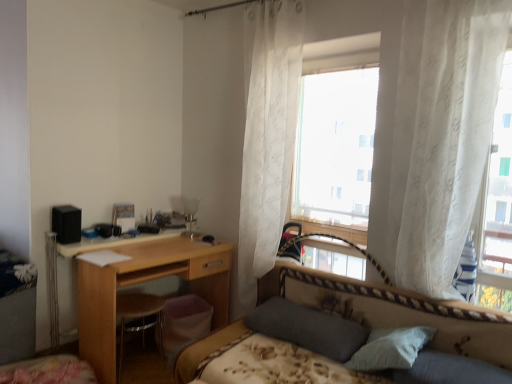
The width and height of the screenshot is (512, 384). I want to click on wooden desk at center, so pos(142,282).

What do you see at coordinates (440, 135) in the screenshot? I see `white sheer curtain at upper right, the second curtain in the left-to-right sequence` at bounding box center [440, 135].

What do you see at coordinates (307, 328) in the screenshot? Image resolution: width=512 pixels, height=384 pixels. I see `dark gray plush pillow at center` at bounding box center [307, 328].

Where is `wooden desk at center`? The height and width of the screenshot is (384, 512). wooden desk at center is located at coordinates (142, 282).

Between point (142, 243) and point (508, 298), which one is positioned behind?

The point (142, 243) is behind.

Which of these two, wooden desk at center or white sheer curtain at right, arranged as the first window when viewed from the front, is thinner?

With smaller width is white sheer curtain at right, arranged as the first window when viewed from the front.

Locate an element on the screen. desk below the white sheer curtain at right, which appears as the 2th window when viewed from the back (from the image's perspective) is located at coordinates (142, 282).

Is white sheer curtains at upper center, placed as the 2th window when sorted from front to back, taller or shorter than white sheer curtain at right, marked as the 1th window in a right-to-left arrangement?

Clearly, white sheer curtains at upper center, placed as the 2th window when sorted from front to back, is shorter compared to white sheer curtain at right, marked as the 1th window in a right-to-left arrangement.

Which object is closer to the camera taking this photo, white sheer curtains at upper center, the 2th window from the right, or white sheer curtain at right, acting as the second window starting from the left?

white sheer curtain at right, acting as the second window starting from the left, is closer to the camera.

Image resolution: width=512 pixels, height=384 pixels. Identify the location of window located above the white sheer curtain at right, acting as the second window starting from the left (from the image's perspective). (336, 140).

Does white sheer curtains at upper center, which is counted as the 1th window, starting from the left, turn towards white sheer curtain at right, which appears as the 2th window when viewed from the back?

No, white sheer curtains at upper center, which is counted as the 1th window, starting from the left, is not aimed at white sheer curtain at right, which appears as the 2th window when viewed from the back.

Is brown leather swivel chair at lower left touching white sheer curtain at right, marked as the 1th window in a right-to-left arrangement?

No, brown leather swivel chair at lower left is not with white sheer curtain at right, marked as the 1th window in a right-to-left arrangement.

Considering the sizes of objects brown leather swivel chair at lower left and white sheer curtain at right, acting as the second window starting from the left, in the image provided, who is bigger, brown leather swivel chair at lower left or white sheer curtain at right, acting as the second window starting from the left,?

white sheer curtain at right, acting as the second window starting from the left.

In the image, there is a white sheer curtain at right, marked as the 1th window in a right-to-left arrangement. Where is `swivel chair below it (from the image's perspective)`? This screenshot has width=512, height=384. swivel chair below it (from the image's perspective) is located at coordinates 137,315.

In the scene shown: Considering the relative positions of brown leather swivel chair at lower left and white sheer curtain at right, which appears as the 2th window when viewed from the back, in the image provided, is brown leather swivel chair at lower left to the left or to the right of white sheer curtain at right, which appears as the 2th window when viewed from the back,?

Based on their positions, brown leather swivel chair at lower left is located to the left of white sheer curtain at right, which appears as the 2th window when viewed from the back.

At what (x,y) coordinates should I click in order to perform the action: click on bed beneath the dark gray plush pillow at center (from a real-world perspective). Please return your answer as a coordinate pair (x, y). The width and height of the screenshot is (512, 384). Looking at the image, I should click on (396, 311).

Can dark gray plush pillow at center be found inside floral-patterned fabric bed at center?

Yes, dark gray plush pillow at center is a part of floral-patterned fabric bed at center.

Is dark gray plush pillow at center at the back of floral-patterned fabric bed at center?

Yes.

From a real-world perspective, between floral-patterned fabric bed at center and dark gray plush pillow at center, who is vertically higher?

From a 3D spatial view, dark gray plush pillow at center is above.

Identify the location of desk that is under the white sheer curtains at upper center, placed as the 2th window when sorted from front to back (from a real-world perspective). (142, 282).

Looking at this image, from a real-world perspective, relative to wooden desk at center, is white sheer curtains at upper center, which is counted as the 1th window, starting from the left, vertically above or below?

white sheer curtains at upper center, which is counted as the 1th window, starting from the left, is above wooden desk at center.

From the image's perspective, which one is positioned higher, white sheer curtain at upper right, which is the first curtain from right to left, or floral-patterned fabric bed at center?

white sheer curtain at upper right, which is the first curtain from right to left.

Which object is thinner, white sheer curtain at upper right, the second curtain in the left-to-right sequence, or floral-patterned fabric bed at center?

Thinner between the two is white sheer curtain at upper right, the second curtain in the left-to-right sequence.

Is white sheer curtain at upper right, placed as the first curtain when sorted from front to back, located outside floral-patterned fabric bed at center?

Indeed, white sheer curtain at upper right, placed as the first curtain when sorted from front to back, is completely outside floral-patterned fabric bed at center.

Would you say floral-patterned fabric bed at center is to the left or to the right of white sheer curtain at center, positioned as the first curtain in left-to-right order, in the picture?

floral-patterned fabric bed at center is to the right of white sheer curtain at center, positioned as the first curtain in left-to-right order.

How many degrees apart are the facing directions of floral-patterned fabric bed at center and white sheer curtain at center, which ranks as the 2th curtain in right-to-left order?

2.18 degrees.

There is a floral-patterned fabric bed at center. Identify the location of the 1st curtain above it (from the image's perspective). (x=267, y=135).

From a real-world perspective, is floral-patterned fabric bed at center physically located above or below white sheer curtain at center, which ranks as the 2th curtain in right-to-left order?

In terms of real-world spatial position, floral-patterned fabric bed at center is below white sheer curtain at center, which ranks as the 2th curtain in right-to-left order.

This screenshot has height=384, width=512. Find the location of `the 1st window directly above the wooden desk at center (from a real-world perspective)`. the 1st window directly above the wooden desk at center (from a real-world perspective) is located at coordinates (496, 207).

The image size is (512, 384). I want to click on window behind the white sheer curtain at right, acting as the second window starting from the left, so click(x=336, y=140).

Estimate the real-world distances between objects in this image. Which object is further from white sheer curtain at upper right, the second curtain in the left-to-right sequence, floral-patterned fabric bed at center or wooden desk at center?

wooden desk at center is positioned further to the anchor white sheer curtain at upper right, the second curtain in the left-to-right sequence.

Considering their positions, is white sheer curtain at center, which ranks as the 2th curtain in right-to-left order, positioned closer to white sheer curtain at right, arranged as the first window when viewed from the front, than brown leather swivel chair at lower left?

white sheer curtain at center, which ranks as the 2th curtain in right-to-left order, lies closer to white sheer curtain at right, arranged as the first window when viewed from the front, than the other object.

Based on their spatial positions, is brown leather swivel chair at lower left or dark gray plush pillow at center further from white sheer curtain at right, acting as the second window starting from the left?

brown leather swivel chair at lower left is further to white sheer curtain at right, acting as the second window starting from the left.

When comparing their distances from white sheer curtain at upper right, the second curtain in the left-to-right sequence, does brown leather swivel chair at lower left or white sheer curtain at right, arranged as the first window when viewed from the front, seem further?

brown leather swivel chair at lower left.

Which object lies nearer to the anchor point brown leather swivel chair at lower left, white sheer curtain at right, marked as the 1th window in a right-to-left arrangement, or dark gray plush pillow at center?

Based on the image, dark gray plush pillow at center appears to be nearer to brown leather swivel chair at lower left.

Looking at the image, which one is located closer to floral-patterned fabric bed at center, brown leather swivel chair at lower left or white sheer curtain at right, which appears as the 2th window when viewed from the back?

white sheer curtain at right, which appears as the 2th window when viewed from the back.

Which object lies further to the anchor point wooden desk at center, brown leather swivel chair at lower left or dark gray plush pillow at center?

dark gray plush pillow at center.

From the image, which object appears to be nearer to white sheer curtains at upper center, which ranks as the first window in back-to-front order, white sheer curtain at center, the 1th curtain viewed from the back, or dark gray plush pillow at center?

white sheer curtain at center, the 1th curtain viewed from the back, is positioned closer to the anchor white sheer curtains at upper center, which ranks as the first window in back-to-front order.

At what (x,y) coordinates should I click in order to perform the action: click on desk positioned between floral-patterned fabric bed at center and brown leather swivel chair at lower left from near to far. Please return your answer as a coordinate pair (x, y). Image resolution: width=512 pixels, height=384 pixels. Looking at the image, I should click on (142, 282).

I want to click on pillow between white sheer curtain at center, positioned as the first curtain in left-to-right order, and brown leather swivel chair at lower left vertically, so click(x=307, y=328).

Where is `window that lies between white sheer curtain at upper right, placed as the first curtain when sorted from front to back, and dark gray plush pillow at center from top to bottom`? The height and width of the screenshot is (384, 512). window that lies between white sheer curtain at upper right, placed as the first curtain when sorted from front to back, and dark gray plush pillow at center from top to bottom is located at coordinates (496, 207).

At what (x,y) coordinates should I click in order to perform the action: click on pillow between wooden desk at center and white sheer curtain at right, arranged as the first window when viewed from the front, in the horizontal direction. Please return your answer as a coordinate pair (x, y). Image resolution: width=512 pixels, height=384 pixels. Looking at the image, I should click on (307, 328).